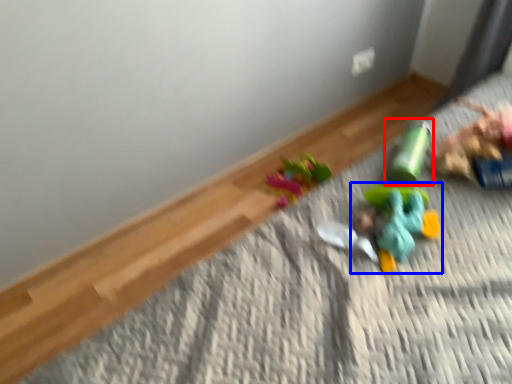
Question: Which of the following is the closest to the observer, toy (highlighted by a red box) or toy (highlighted by a blue box)?

Choices:
 (A) toy
 (B) toy

Answer: (B)